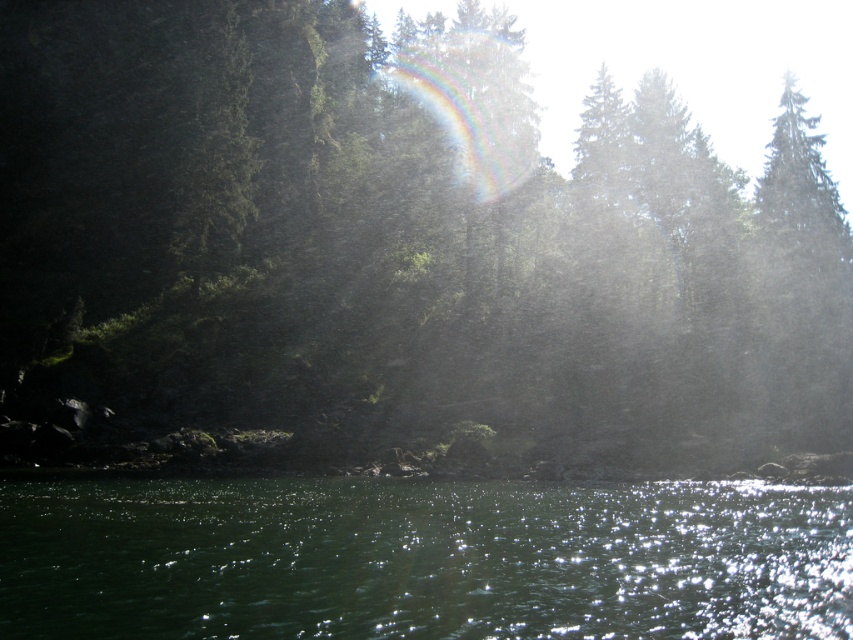
Is green liquid at lower center below rainbow translucent at upper center?

Correct, green liquid at lower center is located below rainbow translucent at upper center.

Measure the distance from green liquid at lower center to rainbow translucent at upper center.

The distance of green liquid at lower center from rainbow translucent at upper center is 119.01 feet.

Which is behind, point (219, 588) or point (514, 112)?

Point (514, 112)

Identify the location of green liquid at lower center. The width and height of the screenshot is (853, 640). (422, 560).

Is point (674, 132) less distant than point (337, 554)?

No, it is not.

Which is behind, point (248, 173) or point (12, 524)?

Positioned behind is point (248, 173).

Does point (128, 76) come farther from viewer compared to point (577, 634)?

Yes, point (128, 76) is behind point (577, 634).

Locate an element on the screen. This screenshot has width=853, height=640. green matte tree at center is located at coordinates (396, 244).

Between point (86, 179) and point (466, 99), which one is positioned in front?

Positioned in front is point (86, 179).

Is green matte tree at center further to camera compared to rainbow translucent at upper center?

No.

Does point (555, 177) come in front of point (426, 67)?

Yes, it is in front of point (426, 67).

Locate an element on the screen. This screenshot has width=853, height=640. green matte tree at center is located at coordinates (396, 244).